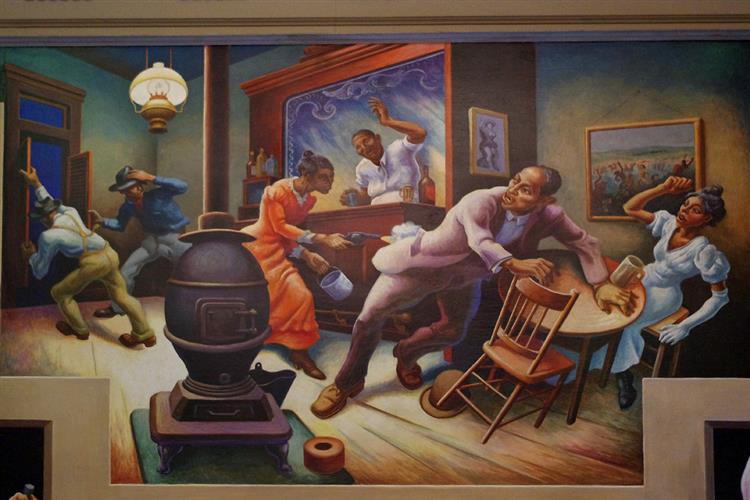
The image size is (750, 500). In order to click on table in this screenshot , I will do `click(578, 325)`.